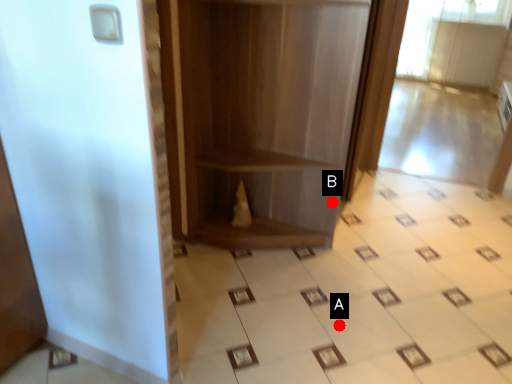
Question: Two points are circled on the image, labeled by A and B beside each circle. Which point is further to the camera?

Choices:
 (A) A is further
 (B) B is further

Answer: (B)